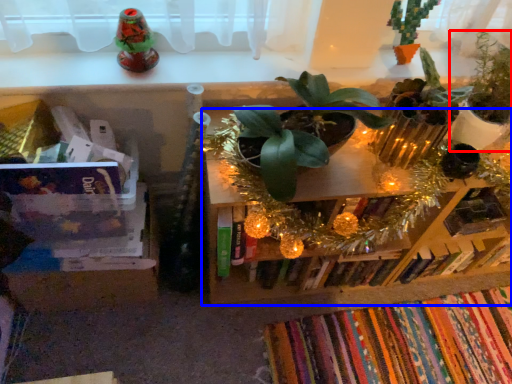
Question: Which of the following is the closest to the observer, houseplant (highlighted by a red box) or shelf (highlighted by a blue box)?

Choices:
 (A) houseplant
 (B) shelf

Answer: (A)